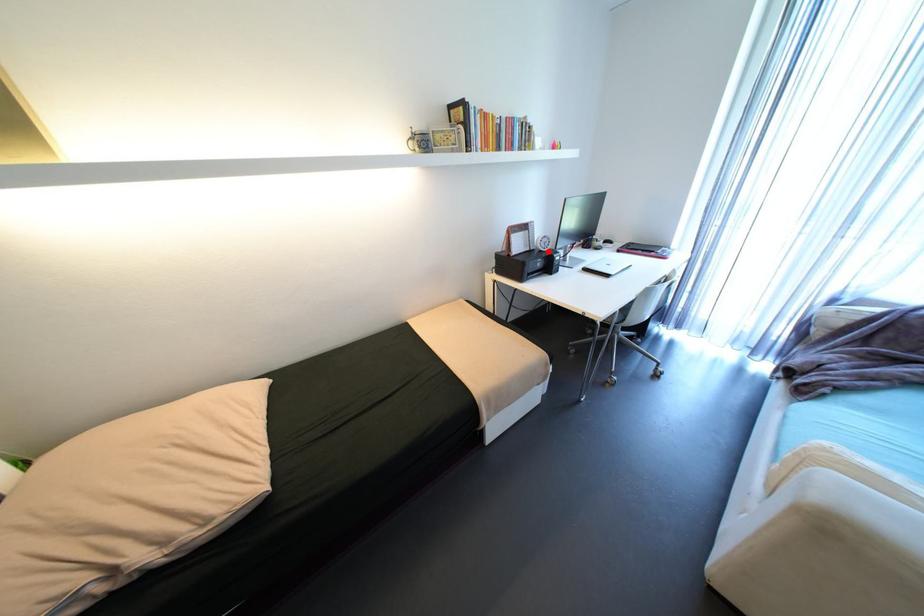
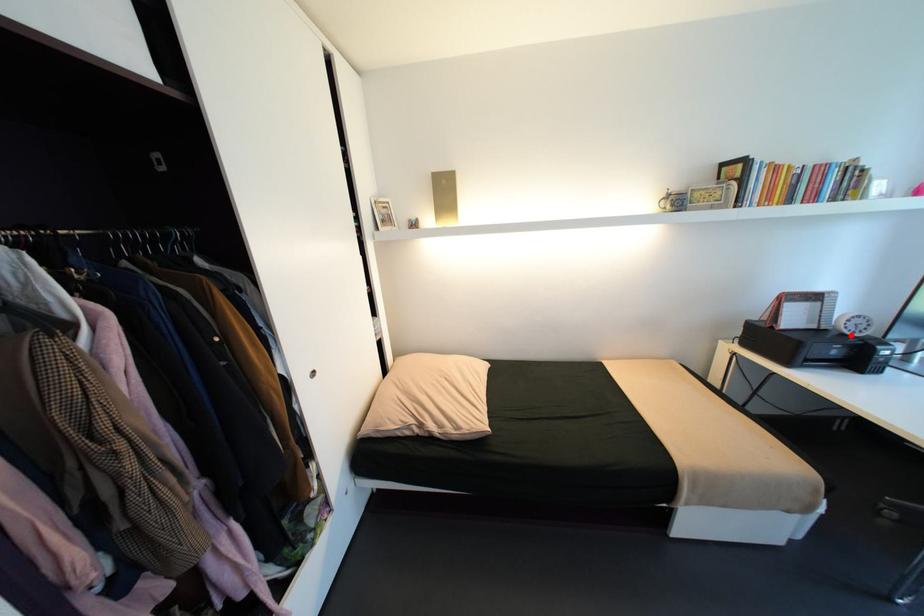
I am providing you with two images of the same scene from different viewpoints. A red point is marked on the first image and another point is marked on the second image. Is the marked point in image1 the same physical position as the marked point in image2?

Yes